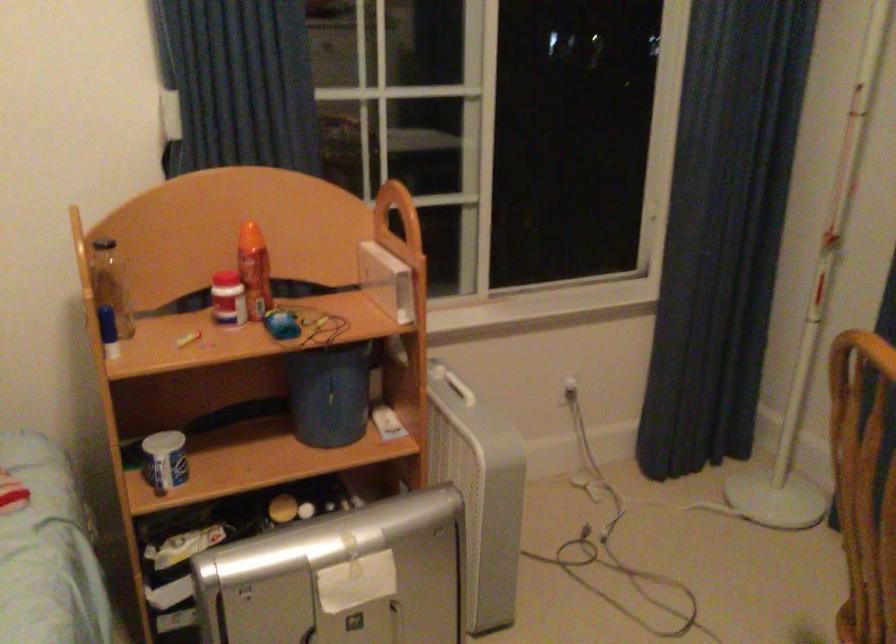
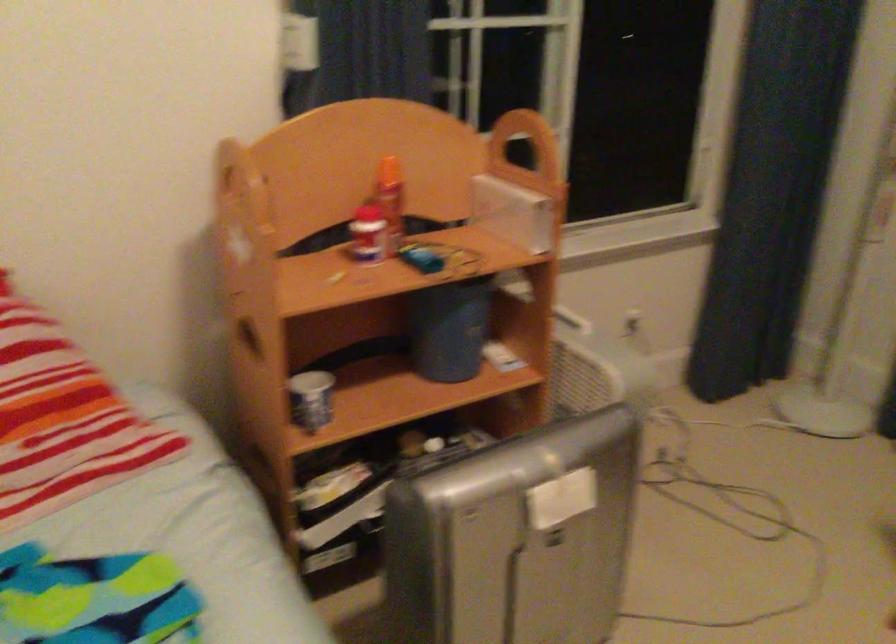
Locate, in the second image, the point that corresponds to [392,200] in the first image.

(512, 128)